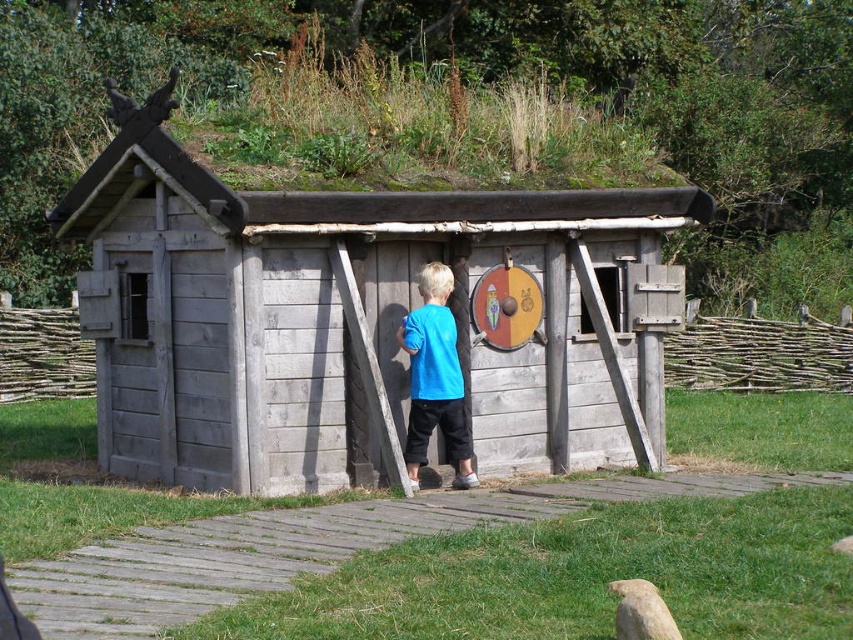
Is point (135, 196) closer to camera compared to point (440, 413)?

No.

Identify the location of weathered wood hut at center. (345, 317).